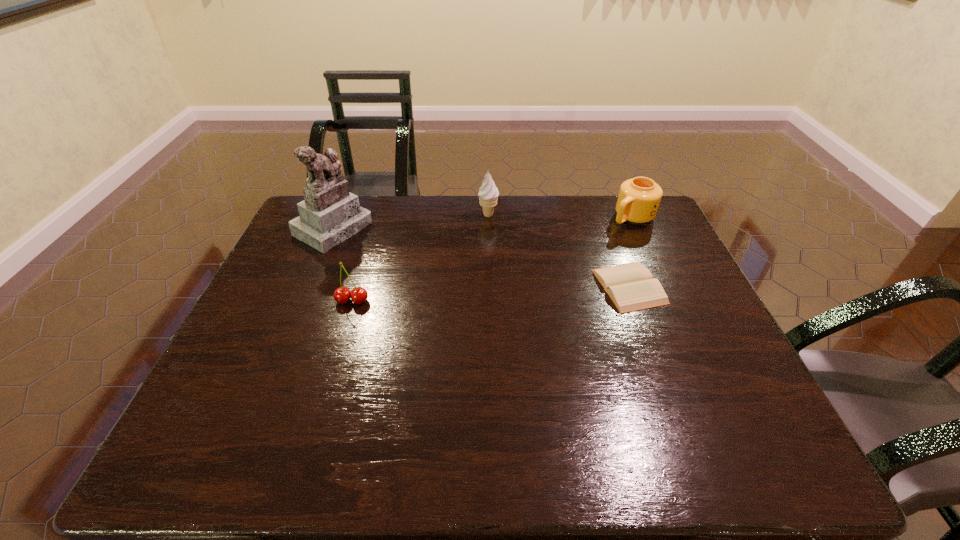
The width and height of the screenshot is (960, 540). I want to click on vacant area between the mug and the figurine, so click(x=483, y=223).

Find the location of a particular element. The width and height of the screenshot is (960, 540). unoccupied area between the mug and the tallest object is located at coordinates (483, 223).

Where is `vacant area that lies between the shortest object and the cherry`? This screenshot has height=540, width=960. vacant area that lies between the shortest object and the cherry is located at coordinates (491, 294).

Locate an element on the screen. free spot between the mug and the second tallest object is located at coordinates (560, 217).

I want to click on unoccupied area between the tallest object and the mug, so click(483, 223).

Find the location of a particular element. The width and height of the screenshot is (960, 540). vacant point located between the figurine and the mug is located at coordinates (483, 223).

Where is `free spot between the mug and the cherry`? This screenshot has height=540, width=960. free spot between the mug and the cherry is located at coordinates (492, 259).

Locate an element on the screen. This screenshot has height=540, width=960. vacant space that's between the diary and the cherry is located at coordinates (491, 294).

The width and height of the screenshot is (960, 540). In order to click on free point between the mug and the cherry in this screenshot , I will do `click(492, 259)`.

I want to click on free point between the third object from right to left and the figurine, so click(411, 221).